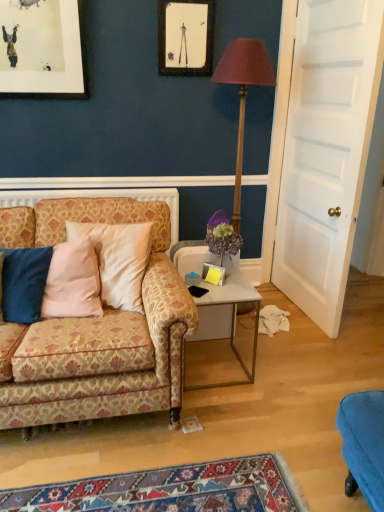
Locate an element on the screen. The height and width of the screenshot is (512, 384). free space to the right of white glossy side table at center is located at coordinates 273,368.